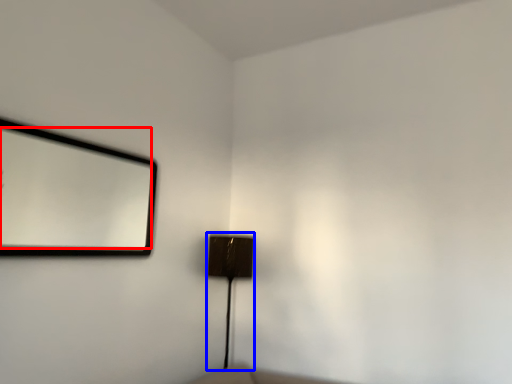
Question: Which object appears closest to the camera in this image, mirror (highlighted by a red box) or lamp (highlighted by a blue box)?

Choices:
 (A) mirror
 (B) lamp

Answer: (A)